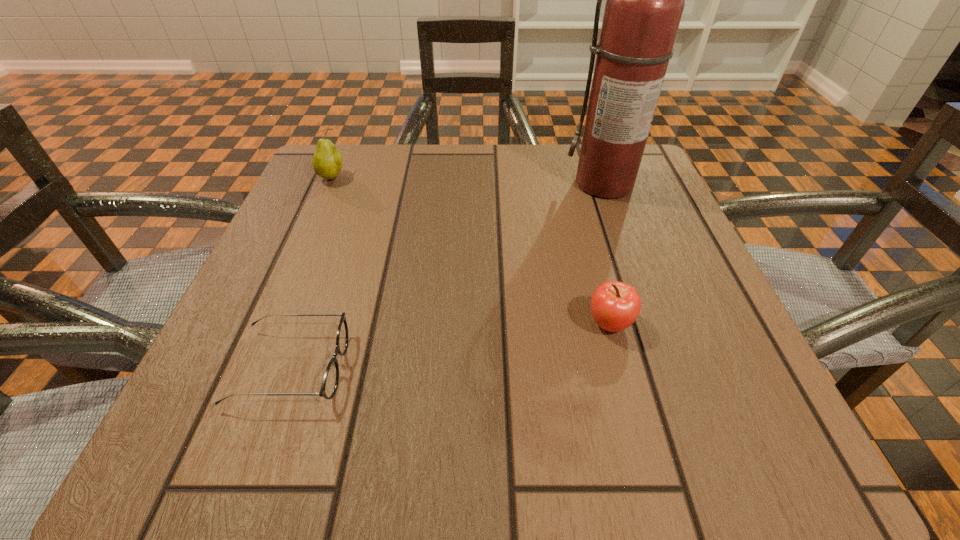
The height and width of the screenshot is (540, 960). What are the coordinates of `the tallest object` in the screenshot? It's located at (645, 0).

Identify the location of the second tallest object. This screenshot has height=540, width=960. (327, 161).

Image resolution: width=960 pixels, height=540 pixels. Find the location of `apple`. apple is located at coordinates (615, 306).

Find the location of a particular element. The height and width of the screenshot is (540, 960). the shortest object is located at coordinates (330, 381).

You are a GUI agent. You are given a task and a screenshot of the screen. Output one action in this format:
    pyautogui.click(x=<x>, y=<y>)
    Task: Click on the vacant space located on the front-facing side of the tallest object
    This screenshot has width=960, height=540.
    Given the screenshot: What is the action you would take?
    pyautogui.click(x=647, y=297)

The height and width of the screenshot is (540, 960). I want to click on free region located 0.310m on the right of the third shortest object, so click(491, 178).

You are a GUI agent. You are given a task and a screenshot of the screen. Output one action in this format:
    pyautogui.click(x=<x>, y=<y>)
    Task: Click on the vacant space situated on the front of the second shortest object
    The width and height of the screenshot is (960, 540).
    Given the screenshot: What is the action you would take?
    pyautogui.click(x=634, y=413)

Find the location of `vacant space located 0.210m through the lenses of the shortest object`. vacant space located 0.210m through the lenses of the shortest object is located at coordinates (496, 368).

Locate an element on the screen. fire extinguisher that is at the far edge is located at coordinates (645, 0).

Where is `pear present at the far edge`? This screenshot has height=540, width=960. pear present at the far edge is located at coordinates (327, 161).